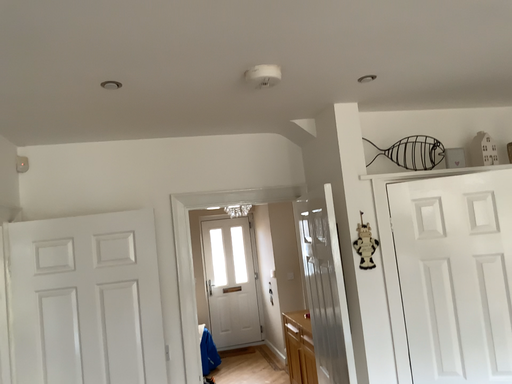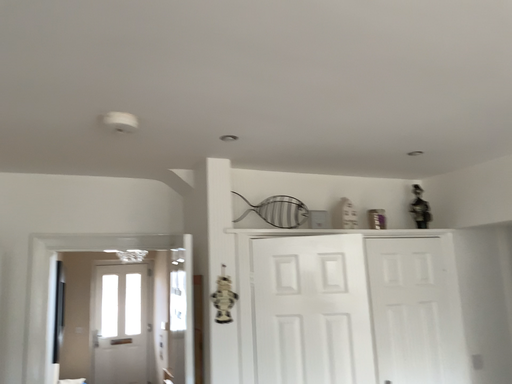
Question: Which way did the camera rotate in the video?

Choices:
 (A) rotated right
 (B) rotated left

Answer: (A)